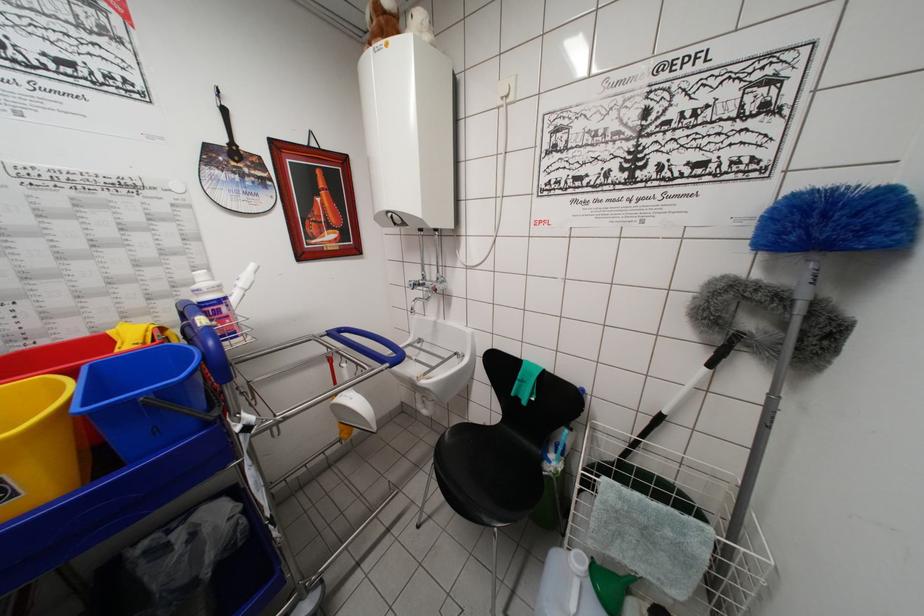
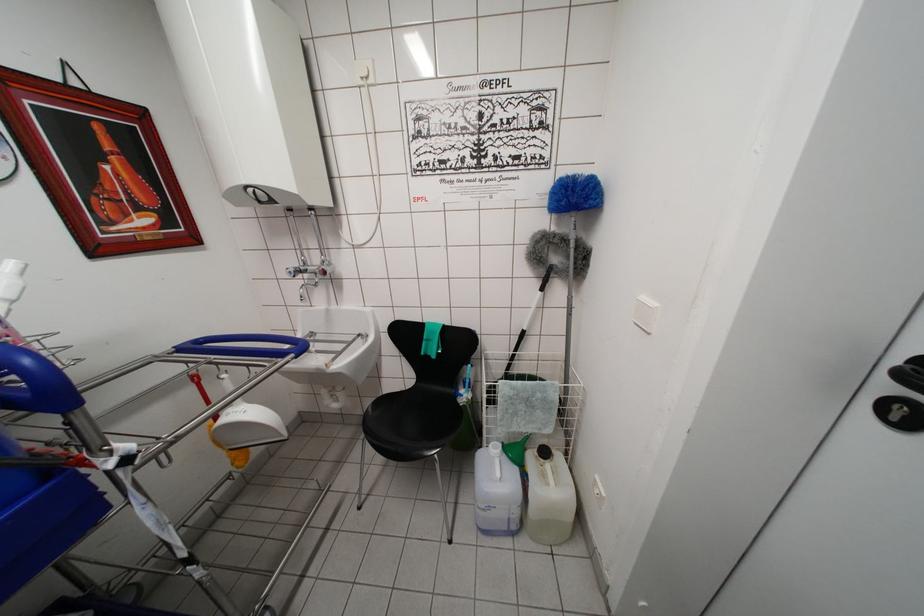
Locate, in the second image, the point that corresponds to pixel 647 440 in the first image.

(518, 354)